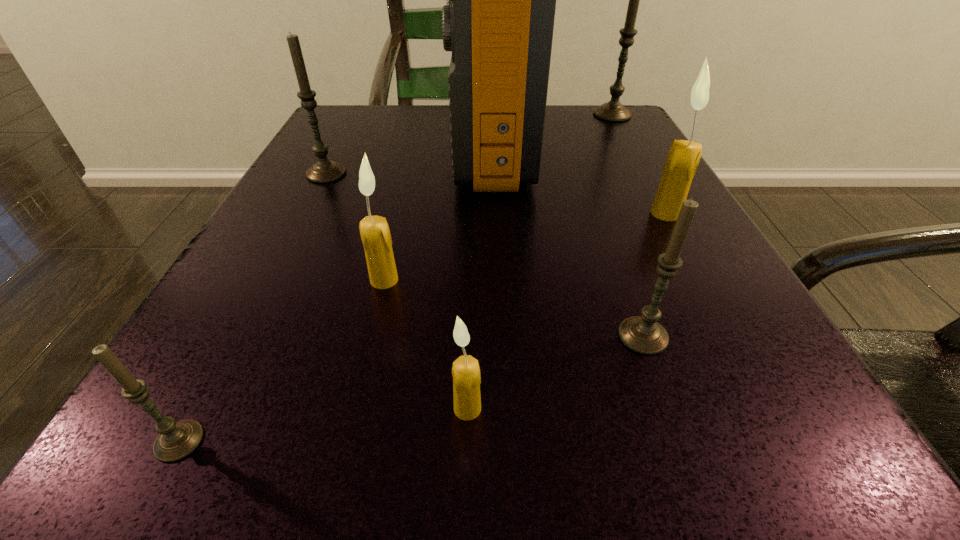
Where is `the third candle from right to left`? the third candle from right to left is located at coordinates (643, 334).

At what (x,y) coordinates should I click in order to perform the action: click on the nearest object. Please return your answer as a coordinate pair (x, y). Looking at the image, I should click on (176, 440).

You are a GUI agent. You are given a task and a screenshot of the screen. Output one action in this format:
    pyautogui.click(x=<x>, y=<y>)
    Task: Click on the nearest gray candle
    The height and width of the screenshot is (540, 960).
    Given the screenshot: What is the action you would take?
    pyautogui.click(x=176, y=440)

The height and width of the screenshot is (540, 960). I want to click on the second nearest candle, so click(465, 370).

Identify the location of the second cream candle from right to left. (465, 370).

Image resolution: width=960 pixels, height=540 pixels. Find the location of `free point located 0.250m on the front-facing side of the radio receiver`. free point located 0.250m on the front-facing side of the radio receiver is located at coordinates (324, 148).

Image resolution: width=960 pixels, height=540 pixels. What are the coordinates of `vacant region located 0.210m on the front-facing side of the radio receiver` in the screenshot? It's located at (346, 148).

The height and width of the screenshot is (540, 960). In order to click on vacant space located on the front-facing side of the radio receiver in this screenshot , I will do `click(324, 148)`.

Locate an element on the screen. free region located 0.340m on the left of the biggest gray candle is located at coordinates (438, 114).

At what (x,y) coordinates should I click in order to perform the action: click on free space located on the right of the second farthest candle. Please return your answer as a coordinate pair (x, y). The height and width of the screenshot is (540, 960). Looking at the image, I should click on (494, 173).